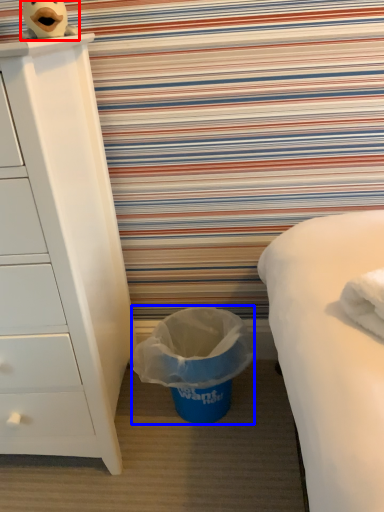
Question: Which object is closer to the camera taking this photo, toy (highlighted by a red box) or garbage (highlighted by a blue box)?

Choices:
 (A) toy
 (B) garbage

Answer: (A)